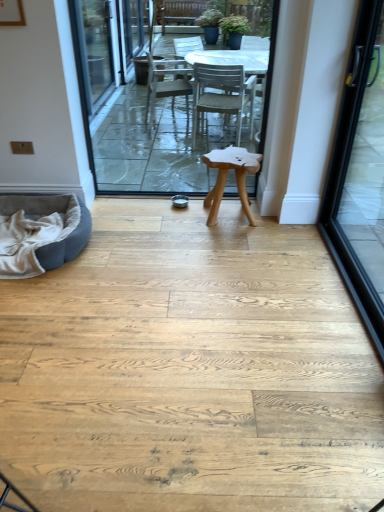
Question: Is natural wood stool at center surrounded by white plastic table at center?

Choices:
 (A) no
 (B) yes

Answer: (A)

Question: Is white plastic table at center bigger than natural wood stool at center?

Choices:
 (A) yes
 (B) no

Answer: (B)

Question: Is white plastic table at center taller than natural wood stool at center?

Choices:
 (A) no
 (B) yes

Answer: (B)

Question: Considering the relative sizes of white plastic table at center and natural wood stool at center in the image provided, is white plastic table at center shorter than natural wood stool at center?

Choices:
 (A) no
 (B) yes

Answer: (A)

Question: Is there a large distance between white plastic table at center and natural wood stool at center?

Choices:
 (A) no
 (B) yes

Answer: (B)

Question: From the image's perspective, is white plastic table at center under natural wood stool at center?

Choices:
 (A) yes
 (B) no

Answer: (B)

Question: Does gray suede bean bag at lower left turn towards natural wood stool at center?

Choices:
 (A) yes
 (B) no

Answer: (B)

Question: Considering the relative positions of gray suede bean bag at lower left and natural wood stool at center in the image provided, is gray suede bean bag at lower left to the left of natural wood stool at center from the viewer's perspective?

Choices:
 (A) yes
 (B) no

Answer: (A)

Question: Is the depth of gray suede bean bag at lower left less than that of natural wood stool at center?

Choices:
 (A) no
 (B) yes

Answer: (B)

Question: Is gray suede bean bag at lower left outside of natural wood stool at center?

Choices:
 (A) no
 (B) yes

Answer: (B)

Question: Considering the relative sizes of gray suede bean bag at lower left and natural wood stool at center in the image provided, is gray suede bean bag at lower left bigger than natural wood stool at center?

Choices:
 (A) no
 (B) yes

Answer: (B)

Question: Does gray suede bean bag at lower left have a lesser width compared to natural wood stool at center?

Choices:
 (A) yes
 (B) no

Answer: (B)

Question: Does natural wood stool at center have a greater width compared to gray suede bean bag at lower left?

Choices:
 (A) no
 (B) yes

Answer: (A)